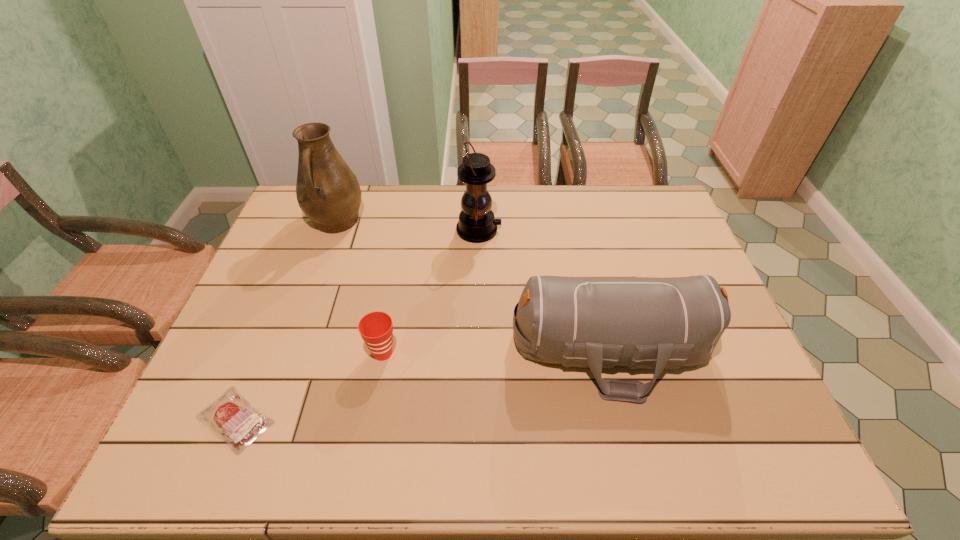
At what (x,y) coordinates should I click in order to perform the action: click on free space located 0.360m on the left of the second shortest object. Please return your answer as a coordinate pair (x, y). Image resolution: width=960 pixels, height=540 pixels. Looking at the image, I should click on (228, 353).

Where is `vacant region located on the back of the steak`? The width and height of the screenshot is (960, 540). vacant region located on the back of the steak is located at coordinates (290, 285).

You are a GUI agent. You are given a task and a screenshot of the screen. Output one action in this format:
    pyautogui.click(x=<x>, y=<y>)
    Task: Click on the pitcher that is at the far edge
    
    Given the screenshot: What is the action you would take?
    pyautogui.click(x=328, y=192)

The image size is (960, 540). I want to click on lantern at the far edge, so point(476,224).

This screenshot has width=960, height=540. In order to click on object that is at the near edge in this screenshot , I will do coord(231,416).

At what (x,y) coordinates should I click in order to perform the action: click on pitcher at the left edge. Please return your answer as a coordinate pair (x, y). This screenshot has height=540, width=960. Looking at the image, I should click on (328, 192).

Find the location of a particular element. steak that is positioned at the left edge is located at coordinates (231, 416).

You are a GUI agent. You are given a task and a screenshot of the screen. Output one action in this format:
    pyautogui.click(x=<x>, y=<y>)
    Task: Click on the object that is at the right edge
    The height and width of the screenshot is (540, 960).
    Given the screenshot: What is the action you would take?
    pyautogui.click(x=655, y=323)

The height and width of the screenshot is (540, 960). I want to click on object present at the far left corner, so coord(328,192).

This screenshot has height=540, width=960. What are the coordinates of `object that is at the near left corner` in the screenshot? It's located at (231, 416).